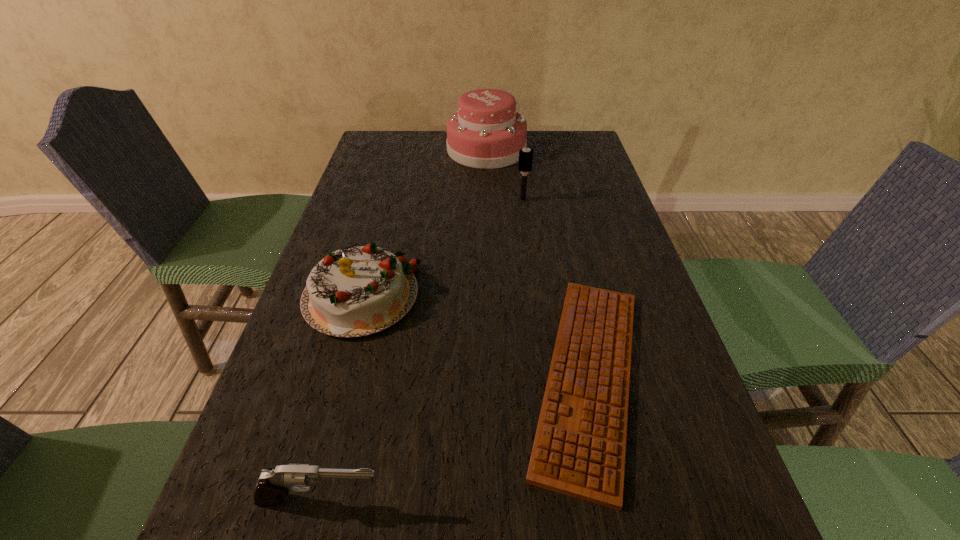
Identify the location of empty space that is in between the shorter cake and the second farthest object. (442, 248).

Locate an element on the screen. object that is the fourth closest to the hairbrush is located at coordinates (272, 484).

Locate an element on the screen. object that is the fourth closest to the second farthest object is located at coordinates (272, 484).

Find the location of a particular element. vacant space that satisfies the following two spatial constraints: 1. on the front side of the computer keyboard; 2. at the muzzle of the gun is located at coordinates [x=615, y=501].